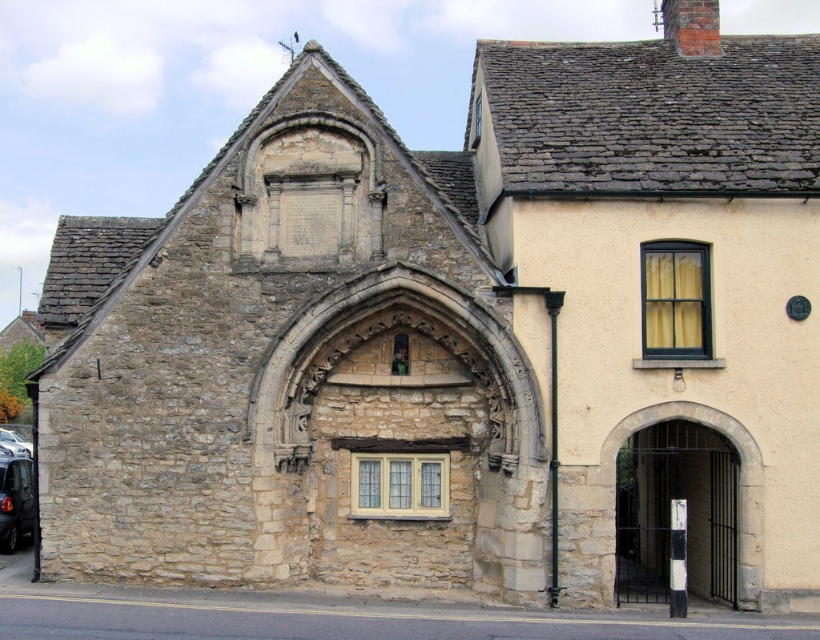
Question: Can you confirm if dark gray metallic car at lower left is bigger than metallic silver car at lower left?

Choices:
 (A) yes
 (B) no

Answer: (B)

Question: From the image, what is the correct spatial relationship of dark gray metallic car at lower left in relation to metallic silver car at lower left?

Choices:
 (A) above
 (B) below

Answer: (A)

Question: Among these objects, which one is farthest from the camera?

Choices:
 (A) dark gray metallic car at lower left
 (B) metallic silver car at lower left

Answer: (B)

Question: Is dark gray metallic car at lower left thinner than metallic silver car at lower left?

Choices:
 (A) no
 (B) yes

Answer: (B)